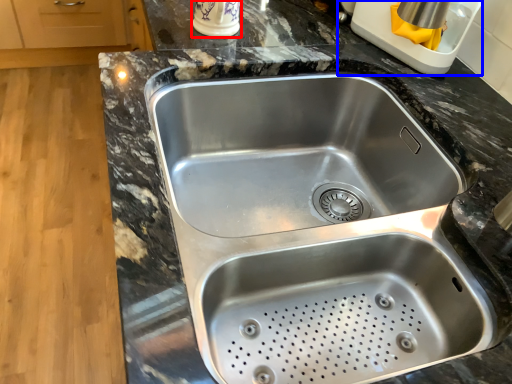
Question: Among these objects, which one is nearest to the camera, appliance (highlighted by a red box) or appliance (highlighted by a blue box)?

Choices:
 (A) appliance
 (B) appliance

Answer: (B)